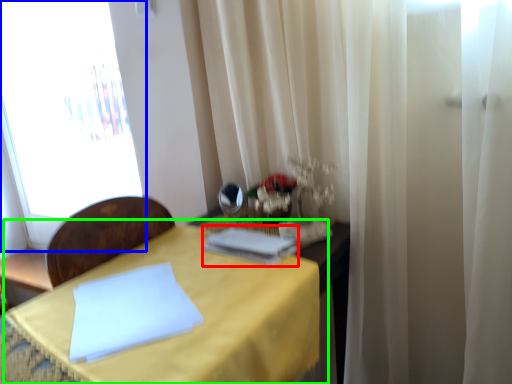
Question: Considering the real-world distances, which object is farthest from book (highlighted by a red box)? window (highlighted by a blue box) or table (highlighted by a green box)?

Choices:
 (A) window
 (B) table

Answer: (A)